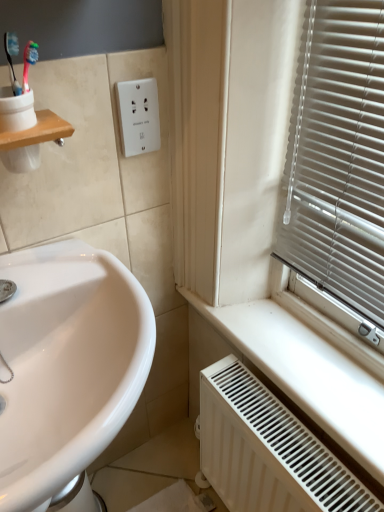
Question: Should I look upward or downward to see white matte radiator at lower right?

Choices:
 (A) up
 (B) down

Answer: (B)

Question: From a real-world perspective, does white plastic outlet at upper center sit lower than wooden shelf at upper left?

Choices:
 (A) no
 (B) yes

Answer: (B)

Question: Does white plastic outlet at upper center appear on the right side of wooden shelf at upper left?

Choices:
 (A) yes
 (B) no

Answer: (A)

Question: Can you confirm if white plastic outlet at upper center is positioned to the left of wooden shelf at upper left?

Choices:
 (A) yes
 (B) no

Answer: (B)

Question: Is white plastic outlet at upper center turned away from wooden shelf at upper left?

Choices:
 (A) no
 (B) yes

Answer: (A)

Question: From the image's perspective, is white plastic outlet at upper center beneath wooden shelf at upper left?

Choices:
 (A) yes
 (B) no

Answer: (B)

Question: Is white plastic outlet at upper center smaller than wooden shelf at upper left?

Choices:
 (A) no
 (B) yes

Answer: (B)

Question: Is white glossy sink at lower left looking in the opposite direction of white plastic outlet at upper center?

Choices:
 (A) yes
 (B) no

Answer: (B)

Question: Considering the relative positions of white glossy sink at lower left and white plastic outlet at upper center in the image provided, is white glossy sink at lower left to the left of white plastic outlet at upper center from the viewer's perspective?

Choices:
 (A) no
 (B) yes

Answer: (B)

Question: Does white glossy sink at lower left turn towards white plastic outlet at upper center?

Choices:
 (A) yes
 (B) no

Answer: (B)

Question: Does white glossy sink at lower left have a larger size compared to white plastic outlet at upper center?

Choices:
 (A) no
 (B) yes

Answer: (B)

Question: From a real-world perspective, is white glossy sink at lower left positioned over white plastic outlet at upper center based on gravity?

Choices:
 (A) yes
 (B) no

Answer: (B)

Question: From the image's perspective, is white glossy sink at lower left below white plastic outlet at upper center?

Choices:
 (A) no
 (B) yes

Answer: (B)

Question: From a real-world perspective, is white matte radiator at lower right below white plastic outlet at upper center?

Choices:
 (A) no
 (B) yes

Answer: (B)